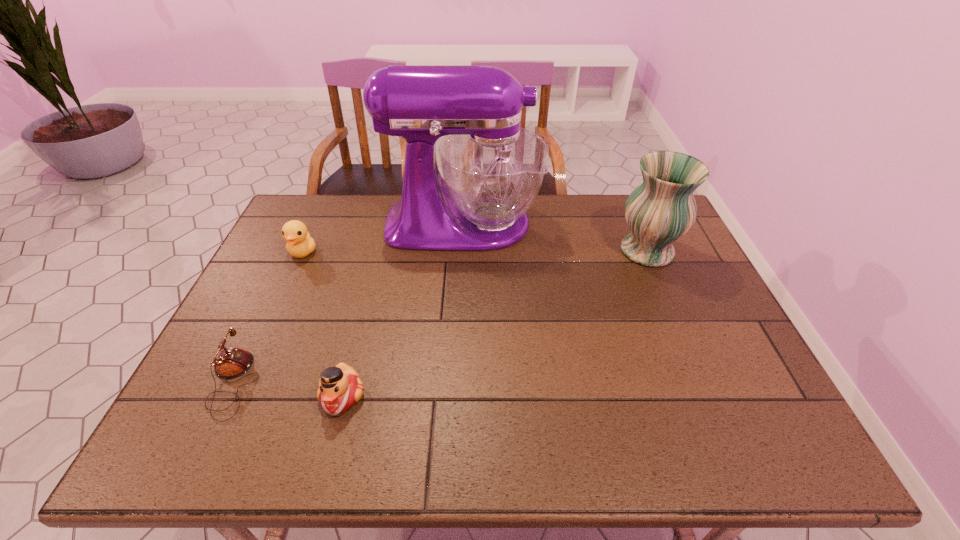
What are the coordinates of `mixer` in the screenshot? It's located at (492, 169).

At what (x,y) coordinates should I click in order to perform the action: click on the rightmost object. Please return your answer as a coordinate pair (x, y). The image size is (960, 540). Looking at the image, I should click on (661, 210).

Locate an element on the screen. The width and height of the screenshot is (960, 540). the fourth shortest object is located at coordinates (661, 210).

Where is `the left duck`? the left duck is located at coordinates (299, 244).

Where is `the right duck`? The height and width of the screenshot is (540, 960). the right duck is located at coordinates (340, 387).

At what (x,y) coordinates should I click in order to perform the action: click on telephone. Please return your answer as a coordinate pair (x, y). This screenshot has height=540, width=960. Looking at the image, I should click on (231, 363).

I want to click on vacant space located 0.350m at the bowl opening of the tallest object, so click(646, 224).

Where is `free spot located on the left of the rightmost object`? This screenshot has height=540, width=960. free spot located on the left of the rightmost object is located at coordinates (577, 251).

Where is `vacant space located 0.070m on the face of the left duck`? Image resolution: width=960 pixels, height=540 pixels. vacant space located 0.070m on the face of the left duck is located at coordinates (290, 280).

This screenshot has width=960, height=540. What are the coordinates of `free space located 0.060m on the face of the right duck` in the screenshot? It's located at (329, 447).